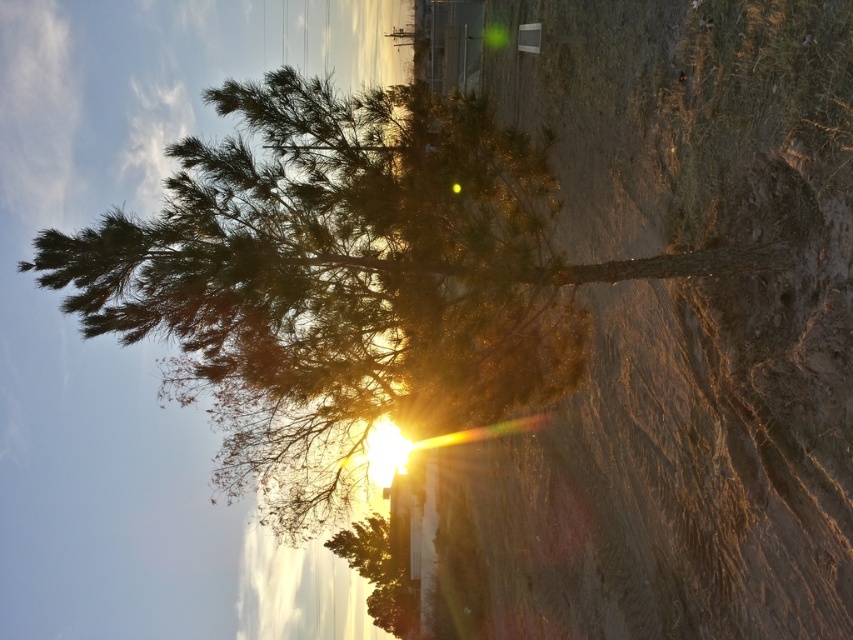
Which is above, brown dirt cliff at center or green leafy tree at center?

green leafy tree at center is higher up.

Does brown dirt cliff at center come behind green leafy tree at center?

No, it is not.

Identify the location of brown dirt cliff at center. This screenshot has height=640, width=853. (672, 326).